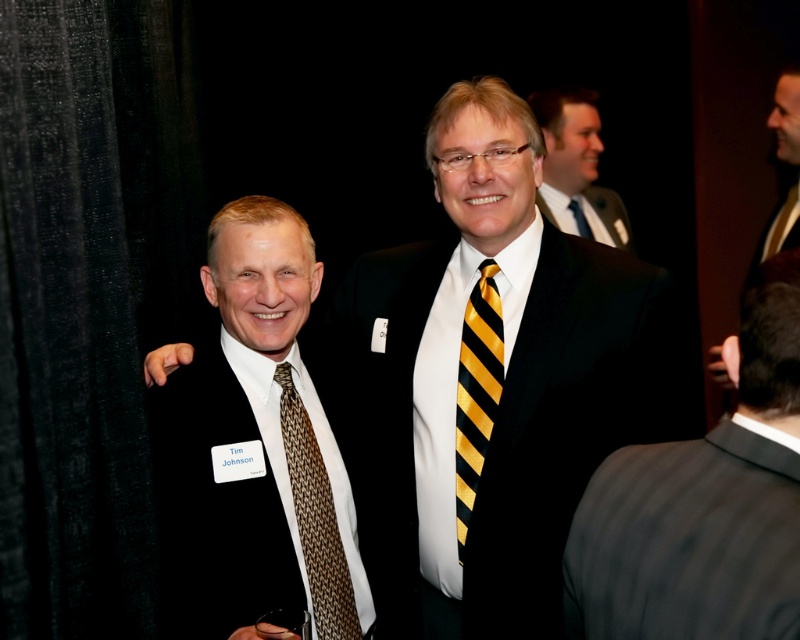
Question: Based on their relative distances, which object is farther from the brown woven tie at center?

Choices:
 (A) gray striped suit at center
 (B) black suit at upper right
 (C) black silk suit at left
 (D) black suit at upper center

Answer: (D)

Question: Is brown woven tie at center bigger than black silk suit at upper center?

Choices:
 (A) no
 (B) yes

Answer: (A)

Question: Among these points, which one is nearest to the camera?

Choices:
 (A) (254, 497)
 (B) (798, 218)
 (C) (576, 221)
 (D) (666, 531)

Answer: (D)

Question: Estimate the real-world distances between objects in this image. Which object is closer to the brown woven tie at center?

Choices:
 (A) black suit at upper right
 (B) black silk suit at upper center
 (C) black silk suit at upper right
 (D) yellow/black striped tie at center

Answer: (D)

Question: Is black suit at upper center wider than black silk suit at upper right?

Choices:
 (A) no
 (B) yes

Answer: (B)

Question: In this image, where is black suit at upper right located relative to black silk suit at upper center?

Choices:
 (A) left
 (B) right

Answer: (B)